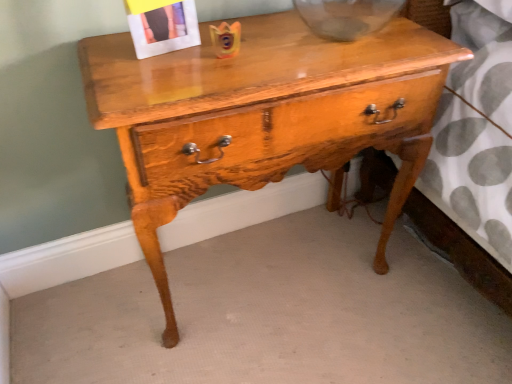
In order to click on free location to the right of glossy wood nightstand at center in this screenshot , I will do `click(414, 301)`.